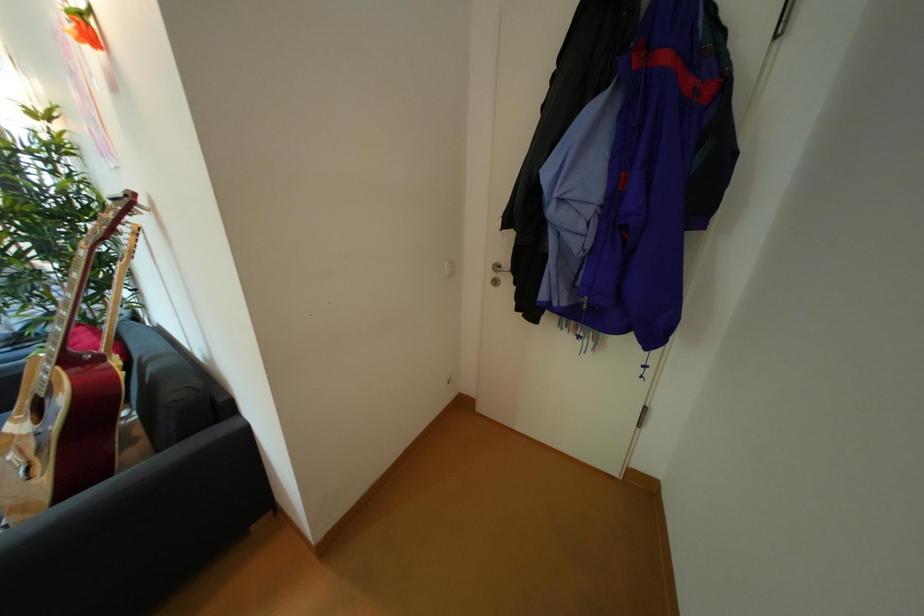
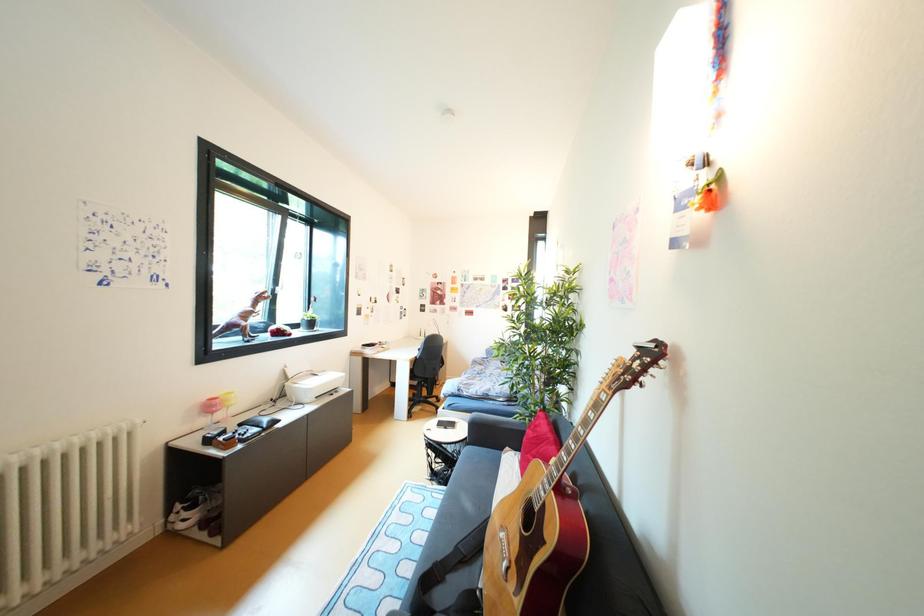
Question: Based on the continuous images, in which direction is the camera rotating? Reply with the corresponding letter.

Choices:
 (A) Left
 (B) Right
 (C) Up
 (D) Down

Answer: (A)